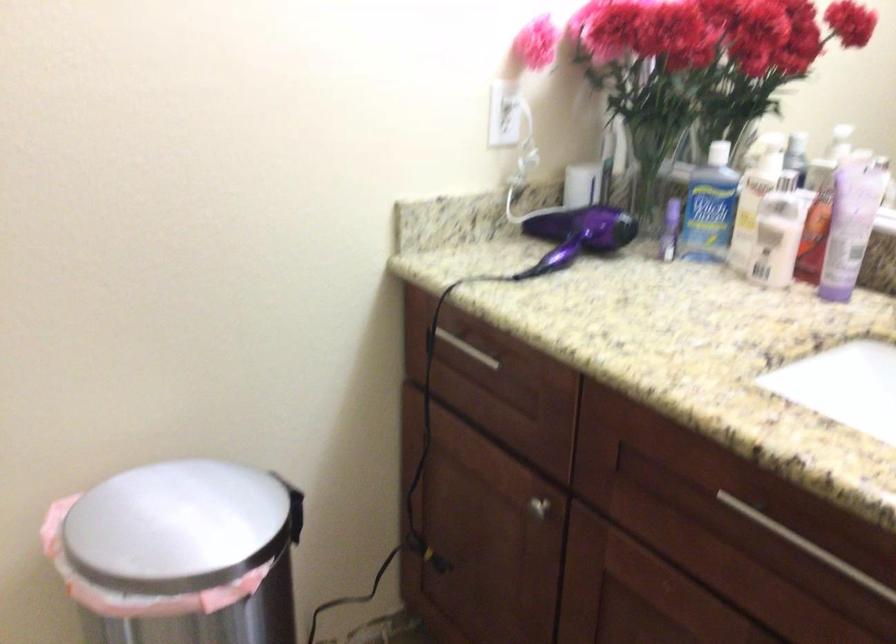
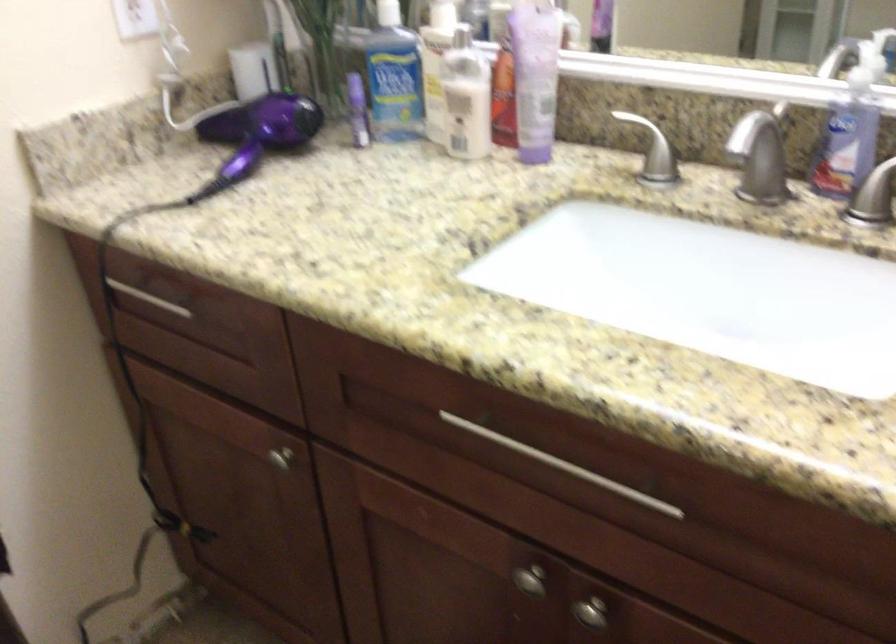
Find the pixel in the second image that matches the point at 773,230 in the first image.

(466, 98)